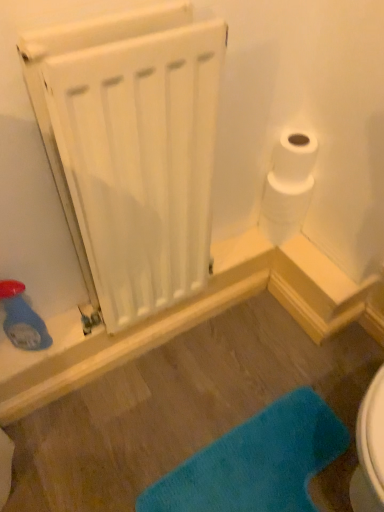
Question: Is point (253, 453) positioned closer to the camera than point (66, 176)?

Choices:
 (A) closer
 (B) farther

Answer: (B)

Question: In the image, is blue fuzzy bath mat at lower center positioned in front of or behind white matte radiator at upper left?

Choices:
 (A) front
 (B) behind

Answer: (B)

Question: Estimate the real-world distances between objects in this image. Which object is closer to the white matte radiator at upper left?

Choices:
 (A) blue fuzzy bath mat at lower center
 (B) white matte toilet paper at upper right

Answer: (B)

Question: Based on their relative distances, which object is nearer to the blue fuzzy bath mat at lower center?

Choices:
 (A) white matte radiator at upper left
 (B) white matte toilet paper at upper right

Answer: (B)